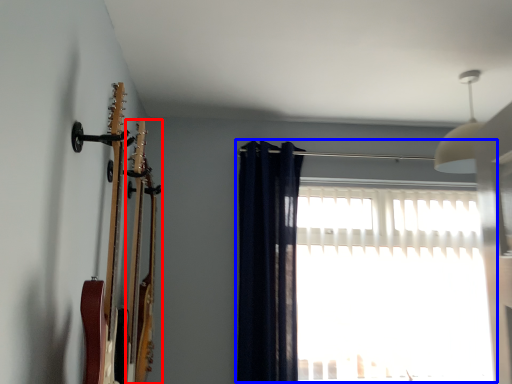
Question: Which object is further to the camera taking this photo, guitar (highlighted by a red box) or window (highlighted by a blue box)?

Choices:
 (A) guitar
 (B) window

Answer: (B)